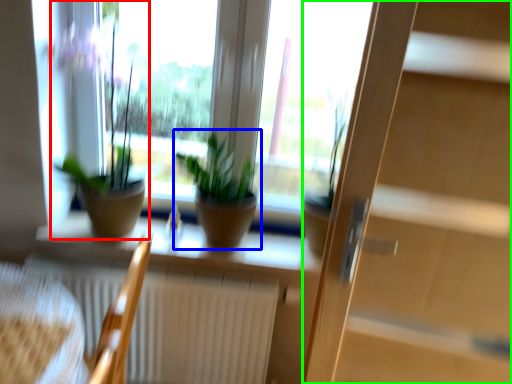
Question: Which object is the closest to the houseplant (highlighted by a red box)? Choose among these: houseplant (highlighted by a blue box) or screen door (highlighted by a green box).

Choices:
 (A) houseplant
 (B) screen door

Answer: (A)